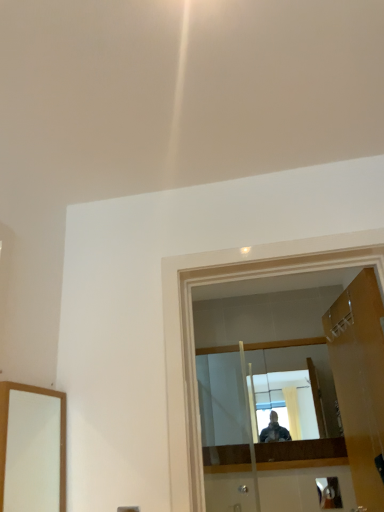
Question: Would you say transparent glass door at center is to the left or to the right of metallic silver door handle at lower right in the picture?

Choices:
 (A) right
 (B) left

Answer: (B)

Question: From the image's perspective, is transparent glass door at center located above or below metallic silver door handle at lower right?

Choices:
 (A) below
 (B) above

Answer: (B)

Question: Estimate the real-world distances between objects in this image. Which object is farther from the metallic silver door handle at lower right?

Choices:
 (A) transparent glass door at center
 (B) wooden door at right

Answer: (A)

Question: Based on their relative distances, which object is farther from the transparent glass door at center?

Choices:
 (A) metallic silver door handle at lower right
 (B) wooden door at right

Answer: (A)